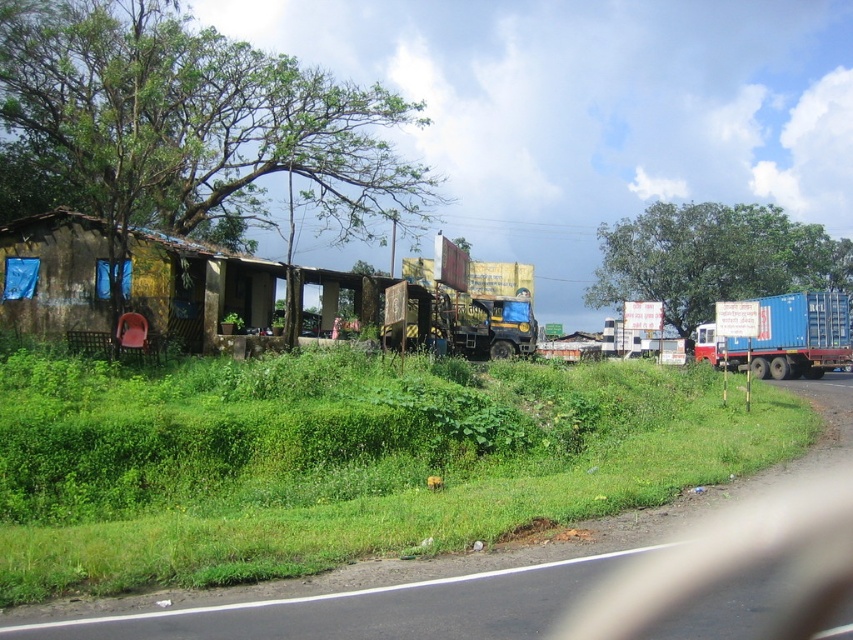
Does point (469, 275) lie behind point (761, 298)?

No.

Is yellow matte trailer truck at center further to camera compared to blue matte container at right?

Yes, it is behind blue matte container at right.

Between point (512, 321) and point (747, 348), which one is positioned in front?

Point (512, 321) is in front.

Find the location of a particular element. yellow matte trailer truck at center is located at coordinates pyautogui.click(x=477, y=301).

Can you confirm if rusty corrugated metal hut at left is wider than yellow matte trailer truck at center?

A: Yes.

Who is more distant from viewer, [276,289] or [477,291]?

The point [477,291] is more distant.

Which is behind, point (132, 241) or point (480, 344)?

Point (480, 344)

This screenshot has width=853, height=640. What are the coordinates of `rusty corrugated metal hut at left` in the screenshot? It's located at (195, 288).

Who is lower down, green grass at lower left or yellow matte trailer truck at center?

green grass at lower left is below.

How far apart are green grass at lower left and yellow matte trailer truck at center?

The distance of green grass at lower left from yellow matte trailer truck at center is 13.97 meters.

Who is more distant from viewer, [531,394] or [479,358]?

Point [479,358]

Where is `green grass at lower left`? The height and width of the screenshot is (640, 853). green grass at lower left is located at coordinates (341, 464).